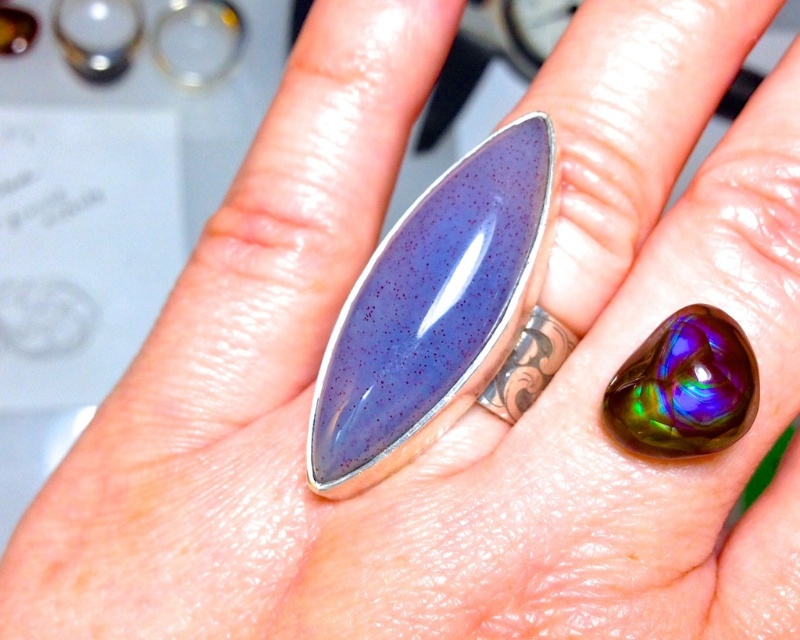
You are a jeweler examining two rings on a customer hand. The customer wants to know which one is bigger. The rings are the purple glossy ring at center and the iridescent gemstone at center. Which one has a bigger size?

The purple glossy ring at center is larger in size than the iridescent gemstone at center.

You are standing 30 inches away from the purple glossy ring at center. Can you see the ring clearly?

The purple glossy ring at center is 30.81 inches away from the viewer. Since you are standing 30 inches away, you are closer than the specified distance, so you can see the ring clearly.

You are a jeweler examining two rings on a customer hand. The customer wants to know which one is taller. The rings are the purple glossy ring at center and the iridescent gemstone at center. Can you tell them?

The purple glossy ring at center has a greater height compared to the iridescent gemstone at center, so the purple glossy ring at center is taller.